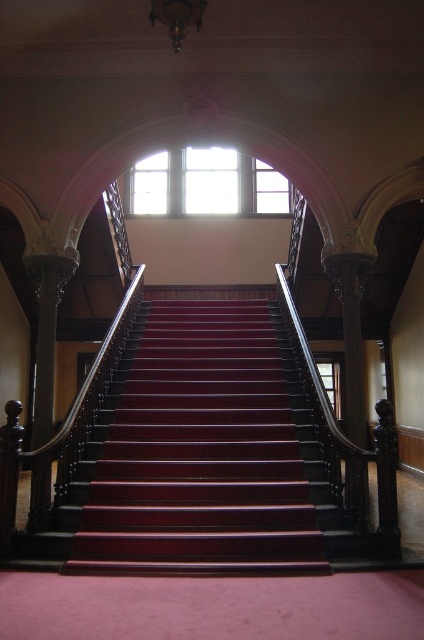
Question: Which point is closer to the camera taking this photo?

Choices:
 (A) [164, 444]
 (B) [248, 211]

Answer: (A)

Question: Can you confirm if mahogany stairs at center is thinner than clear glass window at upper center?

Choices:
 (A) yes
 (B) no

Answer: (A)

Question: Does mahogany stairs at center have a greater width compared to clear glass window at upper center?

Choices:
 (A) no
 (B) yes

Answer: (A)

Question: Can you confirm if mahogany stairs at center is wider than clear glass window at upper center?

Choices:
 (A) yes
 (B) no

Answer: (B)